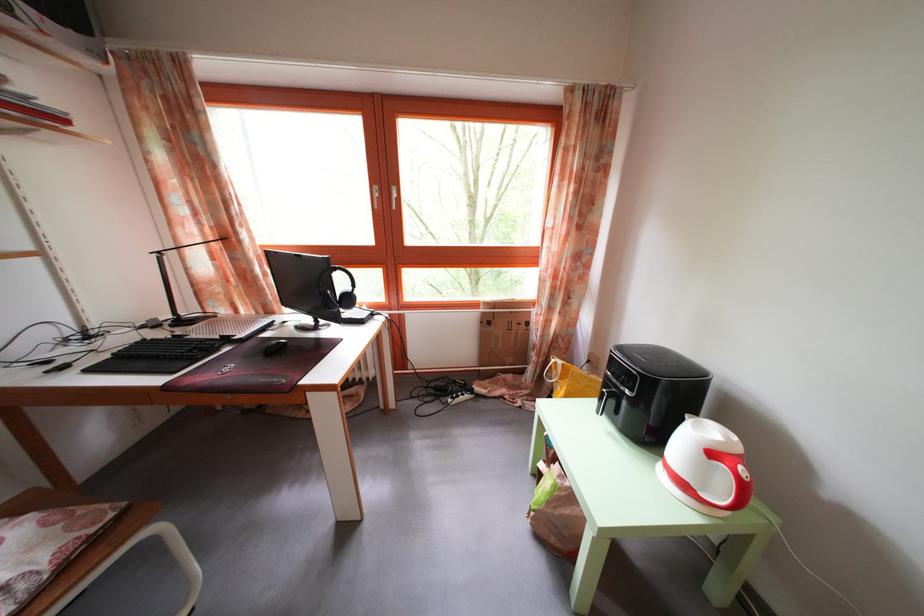
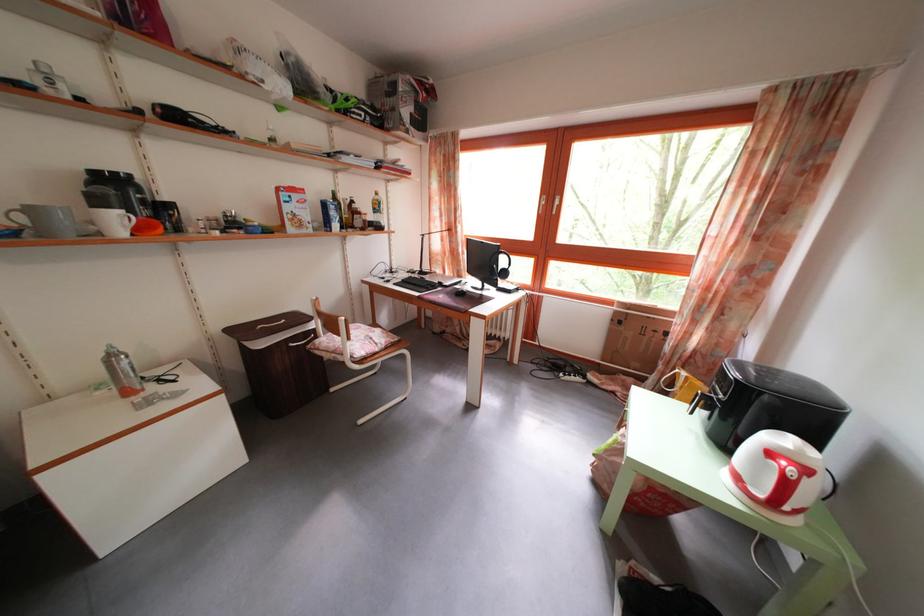
Question: The images are taken continuously from a first-person perspective. In which direction is your viewpoint rotating?

Choices:
 (A) Left
 (B) Right
 (C) Up
 (D) Down

Answer: (A)